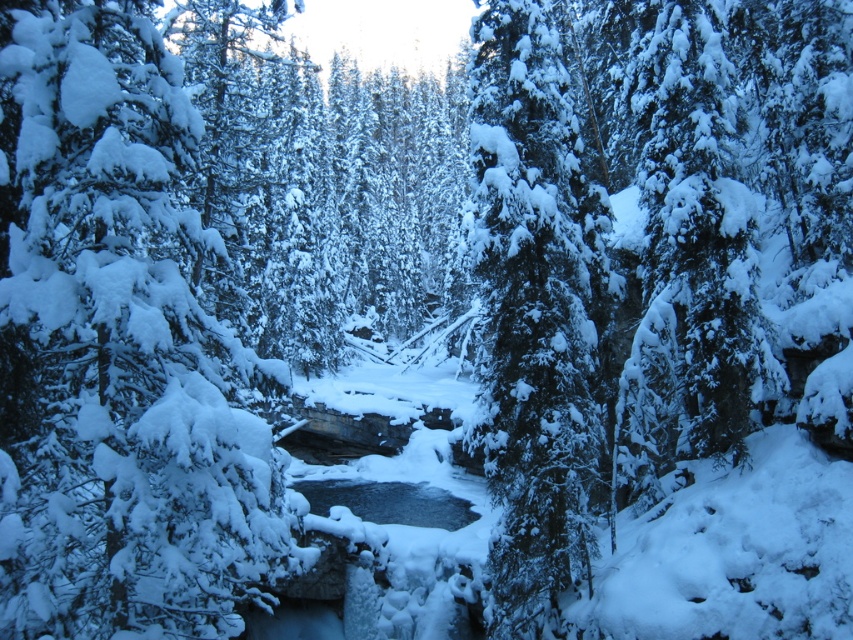
You are standing at a point in the forest and see two points marked in the scene. The first point is labeled as point [16,154] and the second is labeled as point [486,136]. Which point is closer to you?

Point [16,154] is closer to you because it is in front of point [486,136].

You are standing at point A and want to reach point B. The coordinates of point A are point A at [117,205]. The coordinates of point B are point B at 0.677, 0.862. Given that the distance between them is 6.21 meters, can you walk directly from point A to point B without encountering any obstacles?

Yes, you can walk directly from point A to point B without encountering any obstacles because the distance between them is 6.21 meters, and there are no objects mentioned in the scene that would block the path.